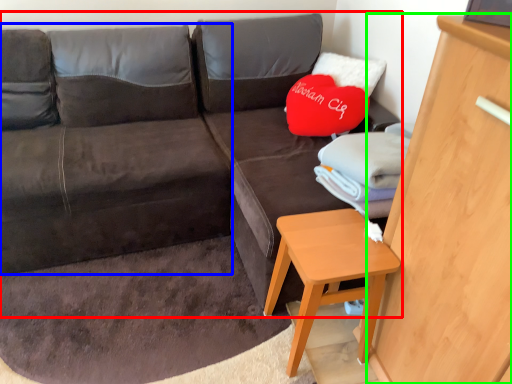
Question: Based on their relative distances, which object is nearer to studio couch (highlighted by a red box)? Choose from bean bag chair (highlighted by a blue box) and dresser (highlighted by a green box).

Choices:
 (A) bean bag chair
 (B) dresser

Answer: (A)